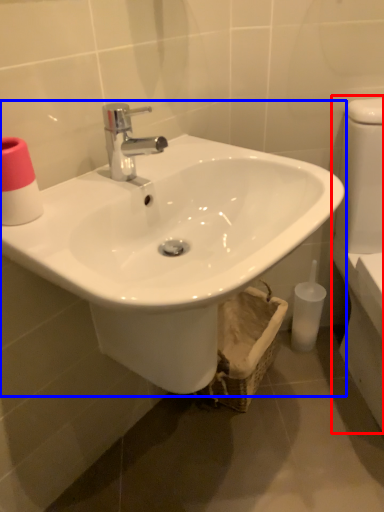
Question: Which of the following is the closest to the observer, porcelain (highlighted by a red box) or sink (highlighted by a blue box)?

Choices:
 (A) porcelain
 (B) sink

Answer: (B)